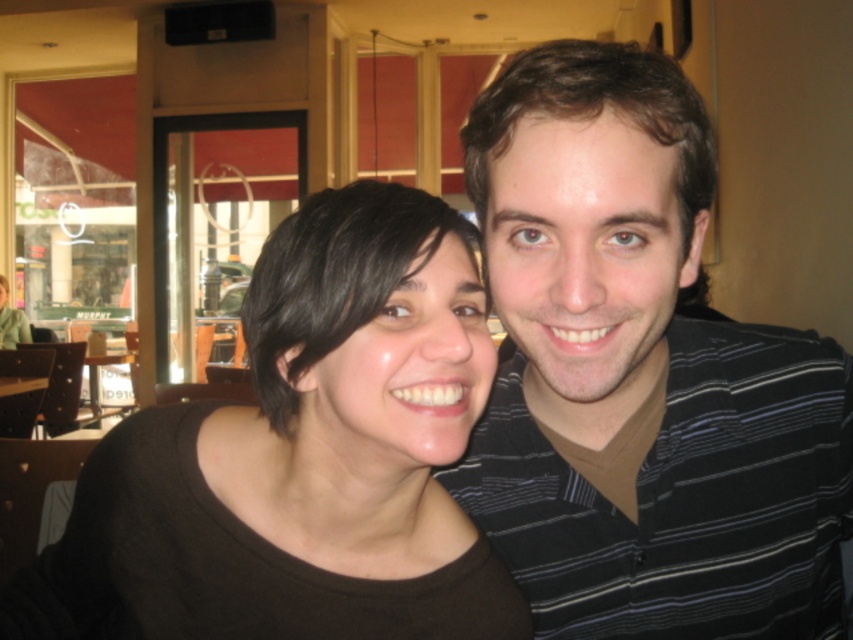
Who is lower down, brown matte shirt at center or matte black shirt at center?

brown matte shirt at center is below.

Between brown matte shirt at center and matte black shirt at center, which one appears on the right side from the viewer's perspective?

Positioned to the right is brown matte shirt at center.

Is point (184, 433) more distant than point (15, 314)?

No, (184, 433) is in front of (15, 314).

Image resolution: width=853 pixels, height=640 pixels. I want to click on brown matte shirt at center, so click(302, 458).

Measure the distance from black striped shirt at right to brown matte shirt at center.

They are 5.33 inches apart.

Locate an element on the screen. The image size is (853, 640). black striped shirt at right is located at coordinates (640, 376).

At what (x,y) coordinates should I click in order to perform the action: click on black striped shirt at right. Please return your answer as a coordinate pair (x, y). The image size is (853, 640). Looking at the image, I should click on (640, 376).

Locate an element on the screen. The image size is (853, 640). black striped shirt at right is located at coordinates (640, 376).

In the scene shown: Which is more to the left, black striped shirt at right or matte black shirt at center?

From the viewer's perspective, matte black shirt at center appears more on the left side.

Is black striped shirt at right shorter than matte black shirt at center?

No, black striped shirt at right is not shorter than matte black shirt at center.

Where is `black striped shirt at right`? This screenshot has width=853, height=640. black striped shirt at right is located at coordinates (640, 376).

You are a GUI agent. You are given a task and a screenshot of the screen. Output one action in this format:
    pyautogui.click(x=<x>, y=<y>)
    Task: Click on the black striped shirt at right
    
    Given the screenshot: What is the action you would take?
    pyautogui.click(x=640, y=376)